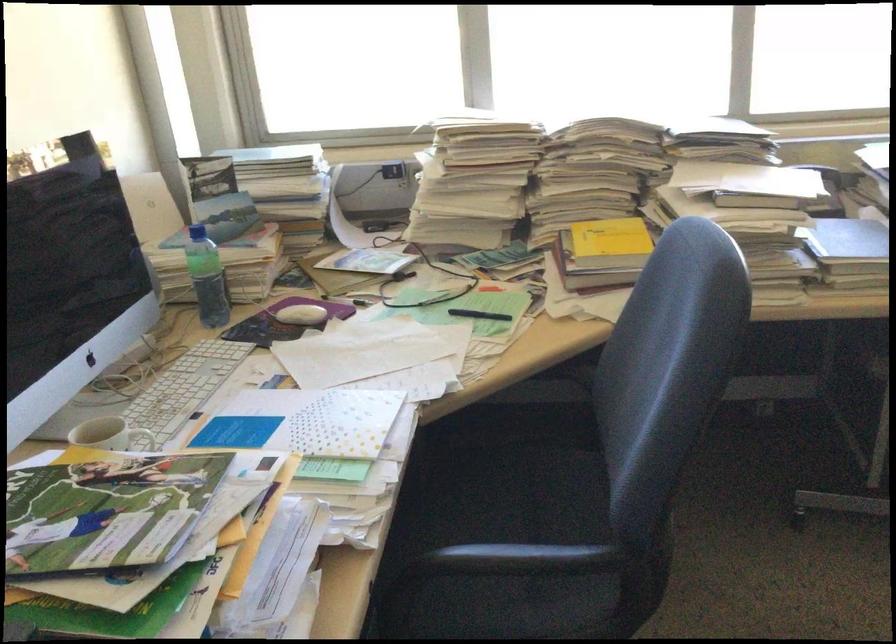
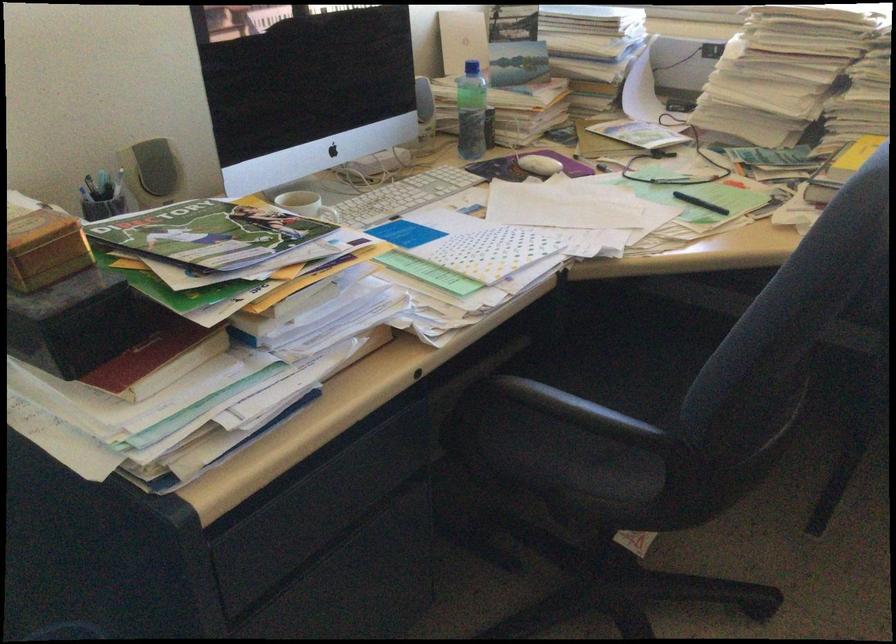
The point at (x=210, y=279) is marked in the first image. Where is the corresponding point in the second image?

(470, 111)